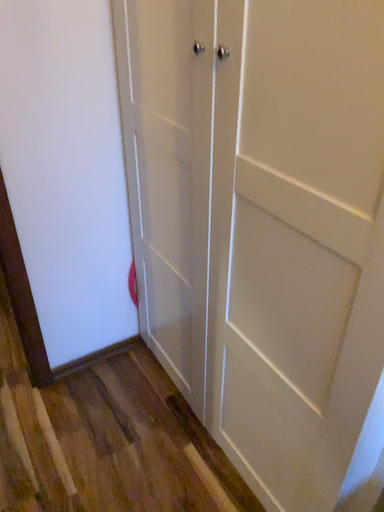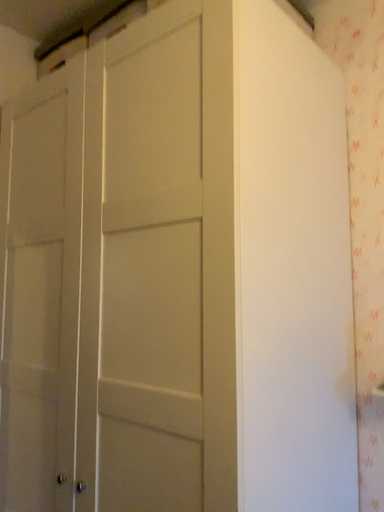
Question: Which way did the camera rotate in the video?

Choices:
 (A) rotated downward
 (B) rotated upward

Answer: (B)